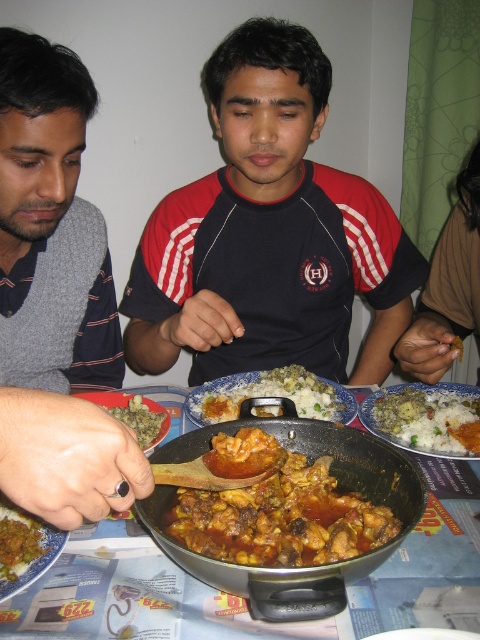
Does point (63, 483) come behind point (67, 586)?

No, it is not.

Is gray sweater at left taller than metallic silver pan at center?

Yes, gray sweater at left is taller than metallic silver pan at center.

Is point (98, 353) farther from camera compared to point (120, 524)?

Yes, it is behind point (120, 524).

Image resolution: width=480 pixels, height=640 pixels. Find the location of `gray sweater at left`. gray sweater at left is located at coordinates (73, 417).

Which is in front, point (239, 106) or point (300, 365)?

Point (239, 106) is in front.

Which of these two, matte black shirt at center or brown matte rice at center, stands taller?

With more height is matte black shirt at center.

Does point (162, 301) come behind point (295, 388)?

Yes, point (162, 301) is behind point (295, 388).

Where is `matte black shirt at center`? This screenshot has width=480, height=640. matte black shirt at center is located at coordinates [268, 234].

How distant is gray sweater at left from brown matte rice at lower left?

gray sweater at left is 17.92 inches away from brown matte rice at lower left.

Between point (16, 262) and point (11, 547), which one is positioned in front?

Point (11, 547) is in front.

You are a GUI agent. You are given a task and a screenshot of the screen. Output one action in this format:
    pyautogui.click(x=<x>, y=<y>)
    Task: Click on the gray sweater at left
    Image resolution: width=480 pixels, height=640 pixels.
    Given the screenshot: What is the action you would take?
    pyautogui.click(x=73, y=417)